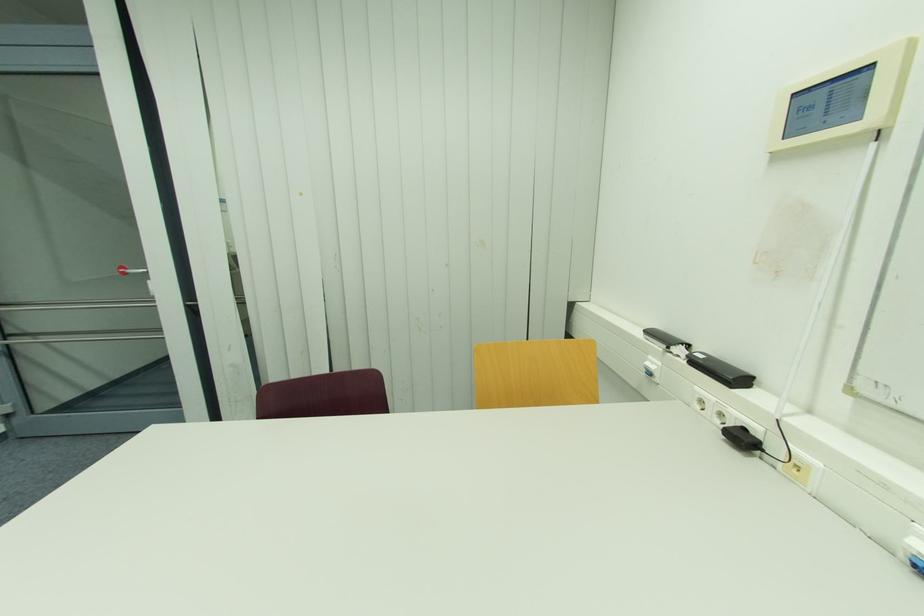
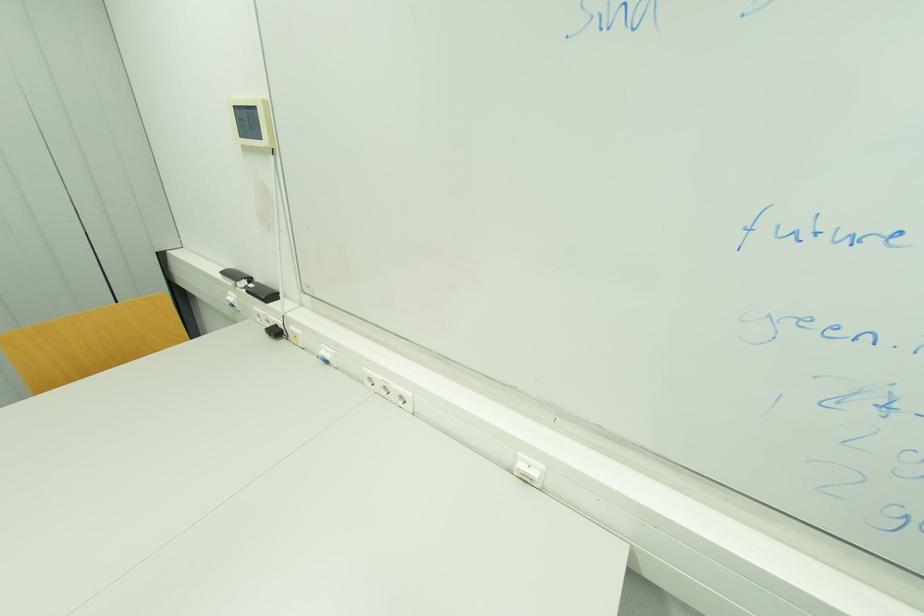
In the second image, find the point that corresponds to point 799,94 in the first image.

(237, 108)